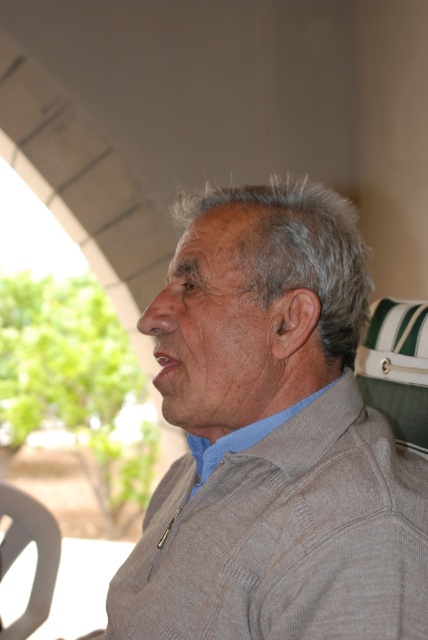
Question: Which point is farther to the camera?

Choices:
 (A) gray knitted sweater at center
 (B) light blue fabric at center

Answer: (B)

Question: Does gray knitted sweater at center appear under light blue fabric at center?

Choices:
 (A) yes
 (B) no

Answer: (B)

Question: Which point is closer to the camera taking this photo?

Choices:
 (A) (249, 230)
 (B) (231, 442)

Answer: (A)

Question: Is gray knitted sweater at center positioned before light blue fabric at center?

Choices:
 (A) no
 (B) yes

Answer: (B)

Question: Among these objects, which one is farthest from the camera?

Choices:
 (A) gray knitted sweater at center
 (B) light blue fabric at center

Answer: (B)

Question: Is gray knitted sweater at center positioned before light blue fabric at center?

Choices:
 (A) no
 (B) yes

Answer: (B)